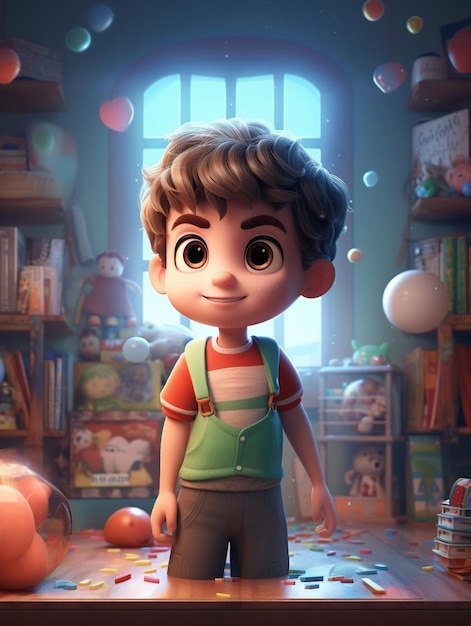
At what (x,y) coordinates should I click in order to perform the action: click on window. Please return your answer as a coordinate pair (x, y). This screenshot has height=626, width=471. Looking at the image, I should click on (242, 103).